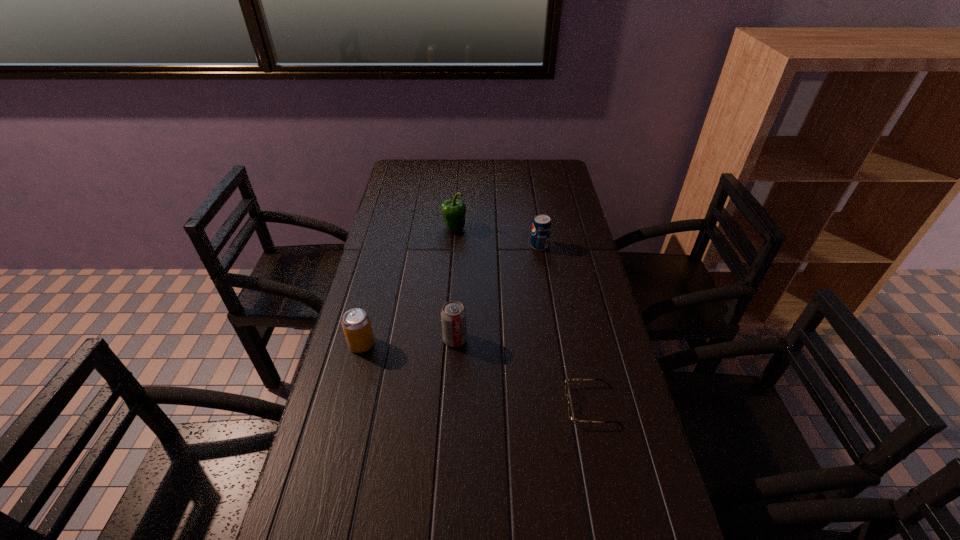
Where is `vacant area situated 0.360m on the left of the fourth nearest object`? This screenshot has width=960, height=540. vacant area situated 0.360m on the left of the fourth nearest object is located at coordinates (425, 246).

Identify the location of free space located 0.100m on the front of the leftmost object. The image size is (960, 540). (351, 387).

Locate an element on the screen. vacant space located 0.090m on the lenses of the shortest object is located at coordinates (528, 404).

Where is `free region located on the lenses of the shortest object`? The height and width of the screenshot is (540, 960). free region located on the lenses of the shortest object is located at coordinates (441, 404).

Locate an element on the screen. vacant area situated on the lenses of the shortest object is located at coordinates 449,404.

The image size is (960, 540). In order to click on object located at the left edge in this screenshot , I will do `click(356, 324)`.

At what (x,y) coordinates should I click in order to perform the action: click on pop located in the right edge section of the desktop. Please return your answer as a coordinate pair (x, y). Looking at the image, I should click on (541, 227).

Image resolution: width=960 pixels, height=540 pixels. I want to click on spectacles at the right edge, so click(x=570, y=409).

Locate an element on the screen. vacant space at the left edge is located at coordinates (398, 315).

The width and height of the screenshot is (960, 540). In the image, there is a desktop. Identify the location of vacant space at the right edge. (588, 326).